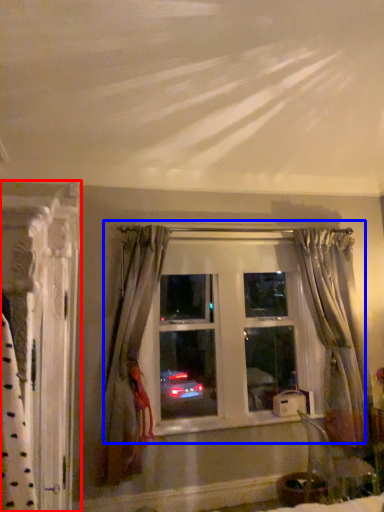
Question: Among these objects, which one is nearest to the camera, curtain (highlighted by a red box) or window (highlighted by a blue box)?

Choices:
 (A) curtain
 (B) window

Answer: (A)